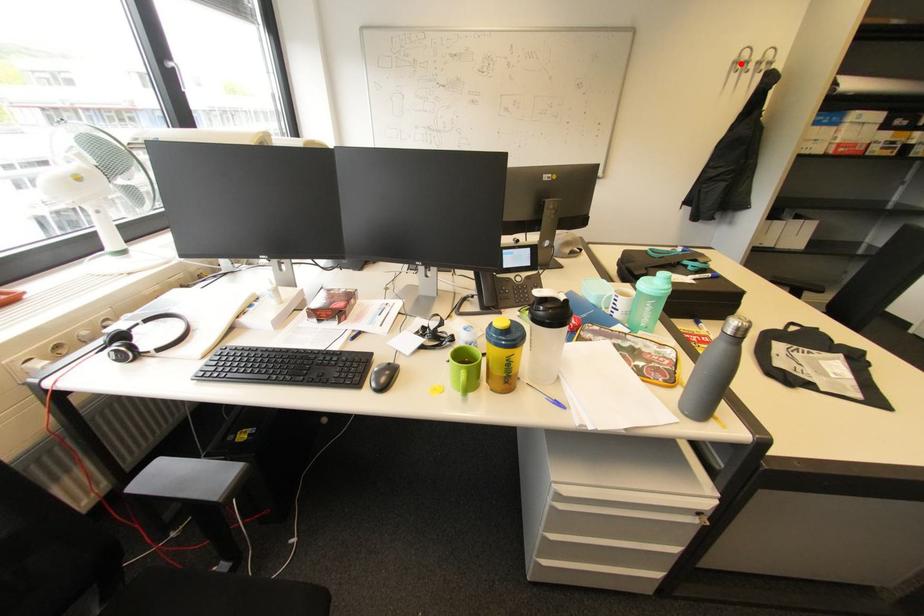
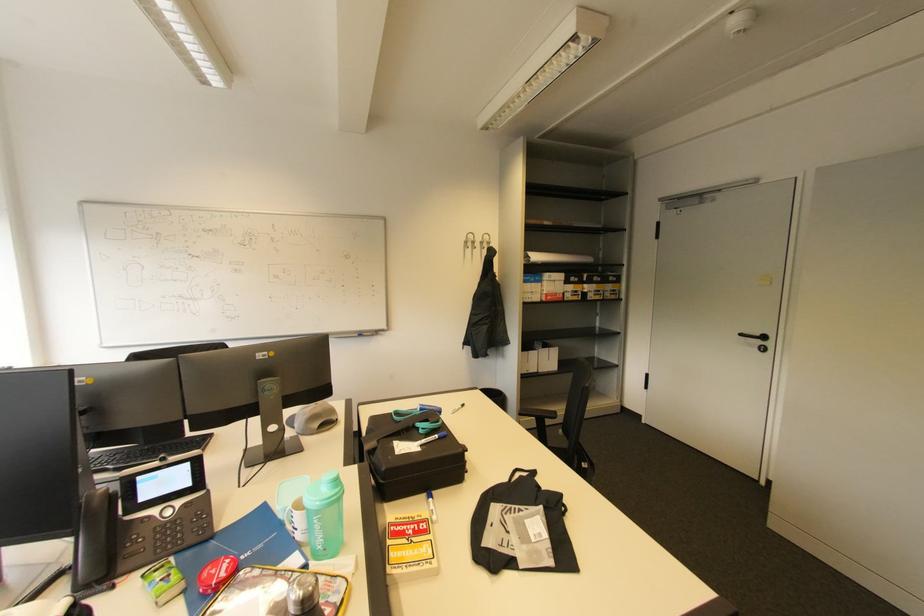
Question: I am providing you with two images of the same scene from different viewpoints. Given a red point in image1, look at the same physical point in image2. Is it:

Choices:
 (A) Closer to the viewpoint
 (B) Farther from the viewpoint

Answer: (A)